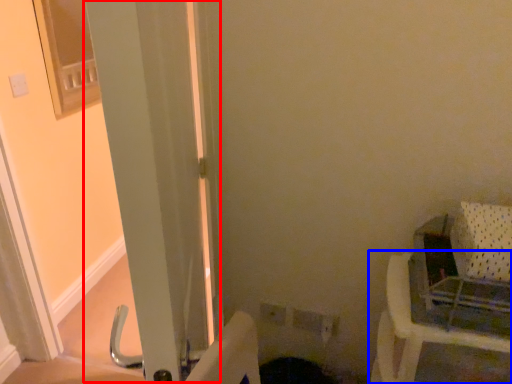
Question: Which of the following is the farthest to the observer, screen door (highlighted by a red box) or furniture (highlighted by a blue box)?

Choices:
 (A) screen door
 (B) furniture

Answer: (B)